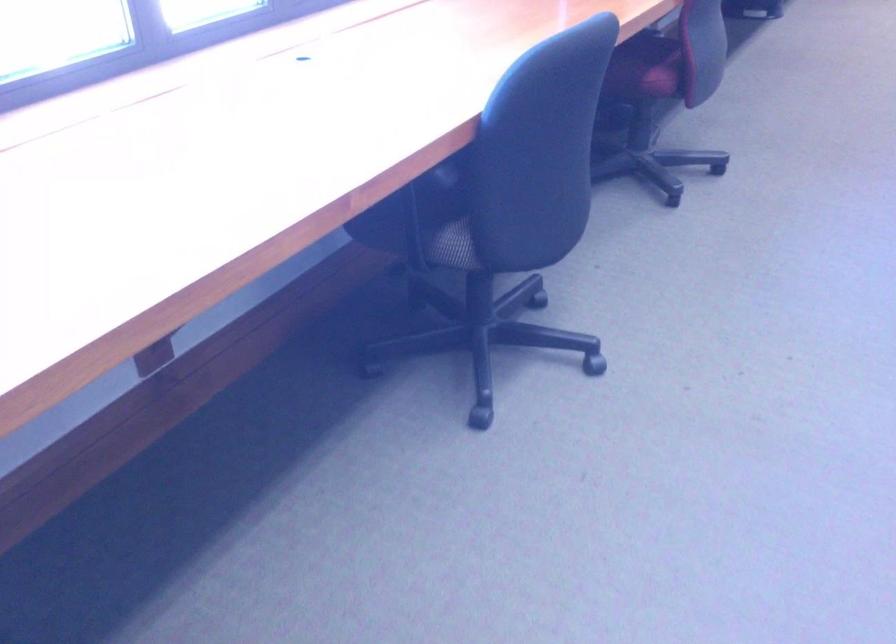
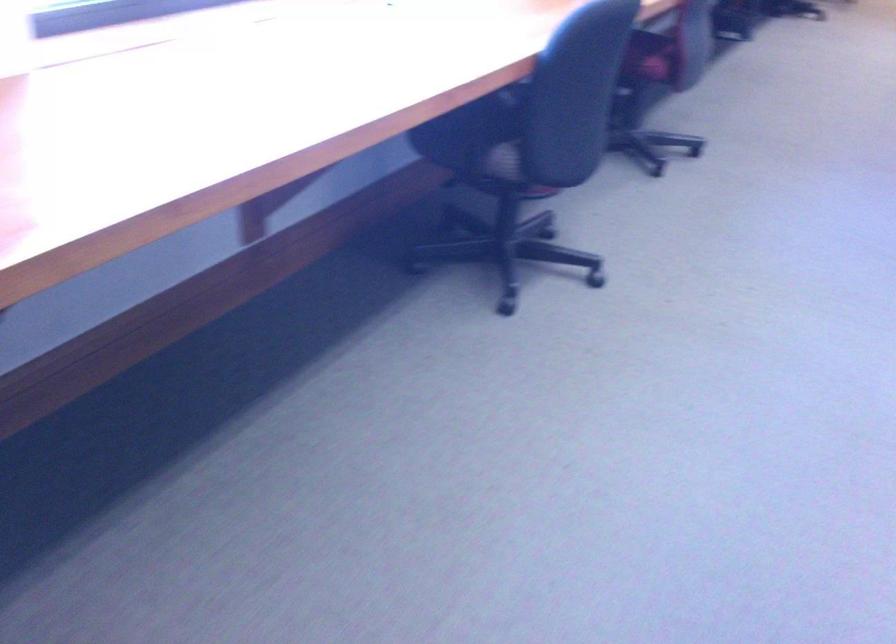
Which direction would the cameraman need to move to produce the second image?

The movement direction of the cameraman is left, backward.